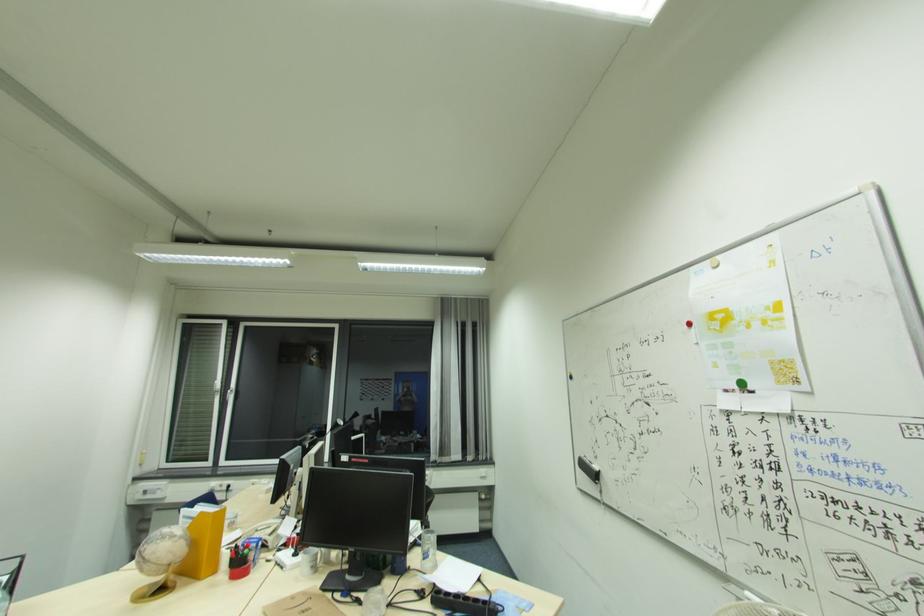
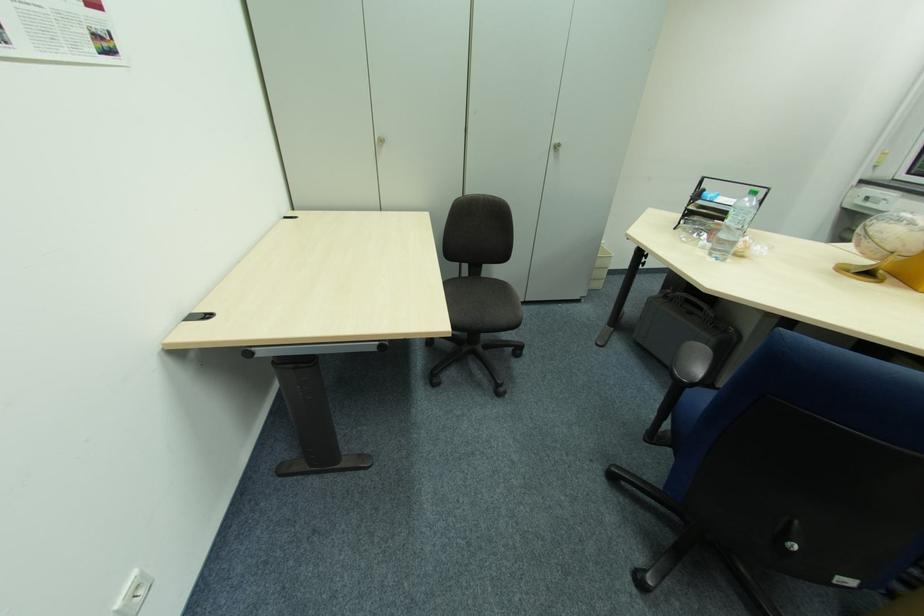
Where in the second image is the point corresponding to (167,564) from the first image?

(893, 249)